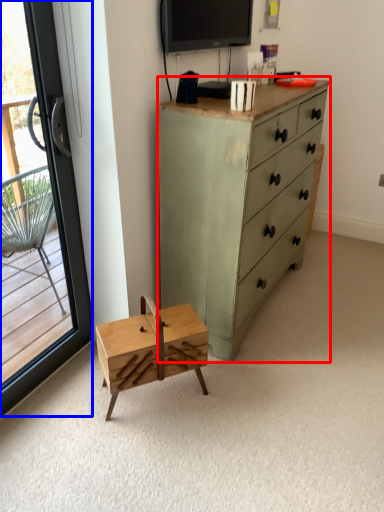
Question: Which of the following is the farthest to the observer, chest of drawers (highlighted by a red box) or window (highlighted by a blue box)?

Choices:
 (A) chest of drawers
 (B) window

Answer: (A)